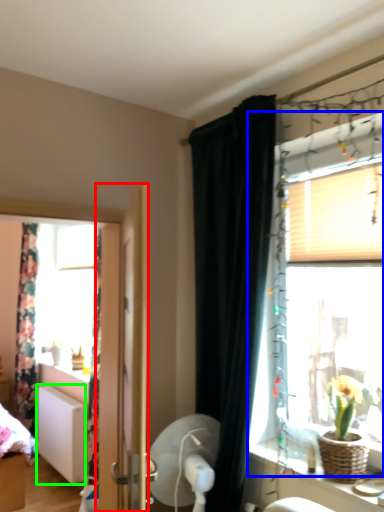
Question: Based on their relative distances, which object is nearer to door (highlighted by a red box)? Choose from window (highlighted by a blue box) and radiator (highlighted by a green box).

Choices:
 (A) window
 (B) radiator

Answer: (A)